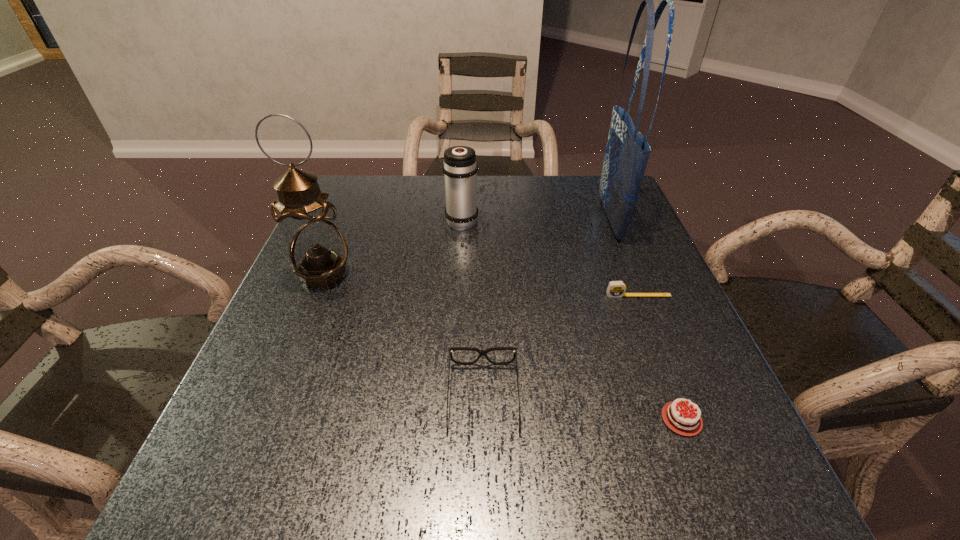
Find the location of a particular element. The width and height of the screenshot is (960, 540). vacant point located between the tallest object and the spectacles is located at coordinates (546, 308).

You are a GUI agent. You are given a task and a screenshot of the screen. Output one action in this format:
    pyautogui.click(x=<x>, y=<y>)
    Task: Click on the free space between the leftmost object and the tape measure
    The height and width of the screenshot is (540, 960).
    Given the screenshot: What is the action you would take?
    point(481,285)

At what (x,y) coordinates should I click in order to perform the action: click on free spot between the tape measure and the thermos bottle. Please return your answer as a coordinate pair (x, y). The width and height of the screenshot is (960, 540). Looking at the image, I should click on (550, 258).

Find the location of a particular element. Image resolution: width=960 pixels, height=540 pixels. vacant point located between the tape measure and the tallest object is located at coordinates (624, 257).

You are a GUI agent. You are given a task and a screenshot of the screen. Output one action in this format:
    pyautogui.click(x=<x>, y=<y>)
    Task: Click on the empty location between the third tallest object and the spectacles
    
    Given the screenshot: What is the action you would take?
    pyautogui.click(x=472, y=309)

This screenshot has height=540, width=960. Find the location of `free spot between the tape measure and the oil lamp`. free spot between the tape measure and the oil lamp is located at coordinates (481, 285).

The image size is (960, 540). In order to click on vacant space that's between the tallest object and the thermos bottle in this screenshot , I will do `click(536, 219)`.

Locate an element on the screen. unoccupied position between the chocolate cake and the thermos bottle is located at coordinates (572, 320).

The image size is (960, 540). Find the location of `unoccupied position between the chocolate cake and the third shortest object`. unoccupied position between the chocolate cake and the third shortest object is located at coordinates (583, 408).

Find the location of a particular element. Image resolution: width=960 pixels, height=540 pixels. free spot between the second tallest object and the spectacles is located at coordinates (403, 336).